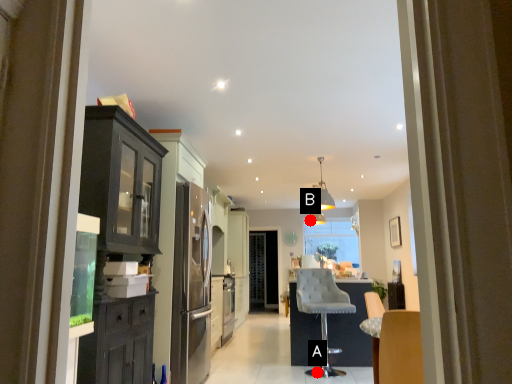
Question: Two points are circled on the image, labeled by A and B beside each circle. Which point is closer to the camera?

Choices:
 (A) A is closer
 (B) B is closer

Answer: (A)